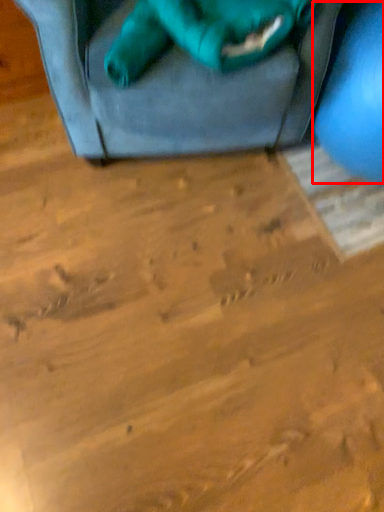
Question: From the image, what is the correct spatial relationship of turquoise (annotated by the red box) in relation to animal?

Choices:
 (A) right
 (B) left

Answer: (A)